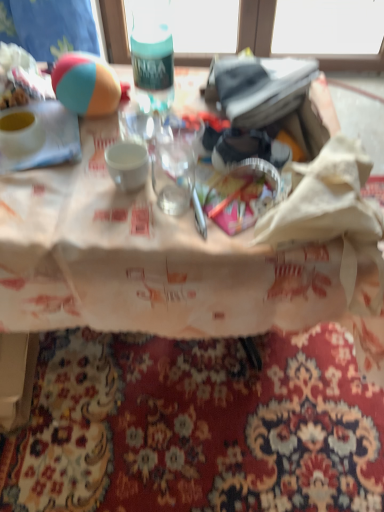
Find the location of `free location to the left of teal matte bottle at upper center`. free location to the left of teal matte bottle at upper center is located at coordinates (100, 123).